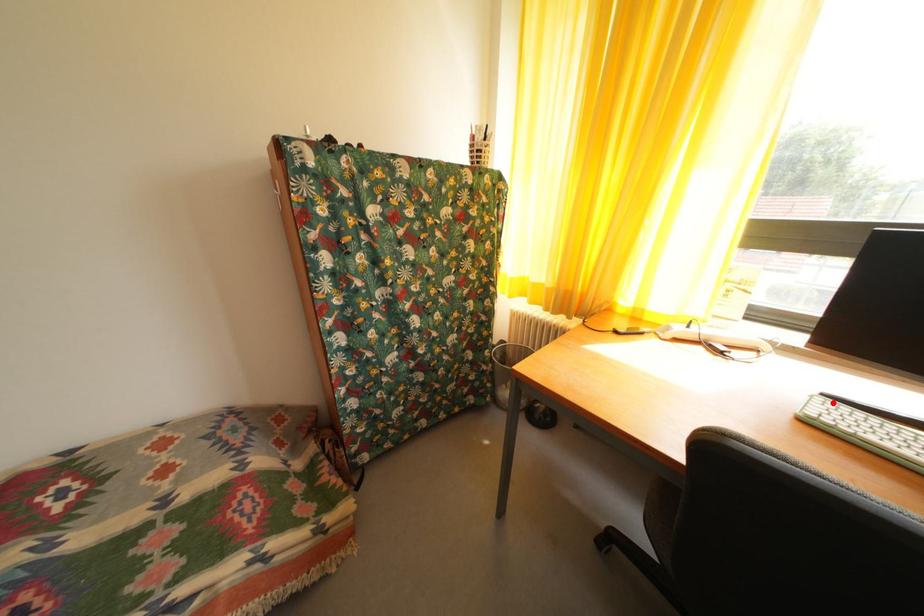
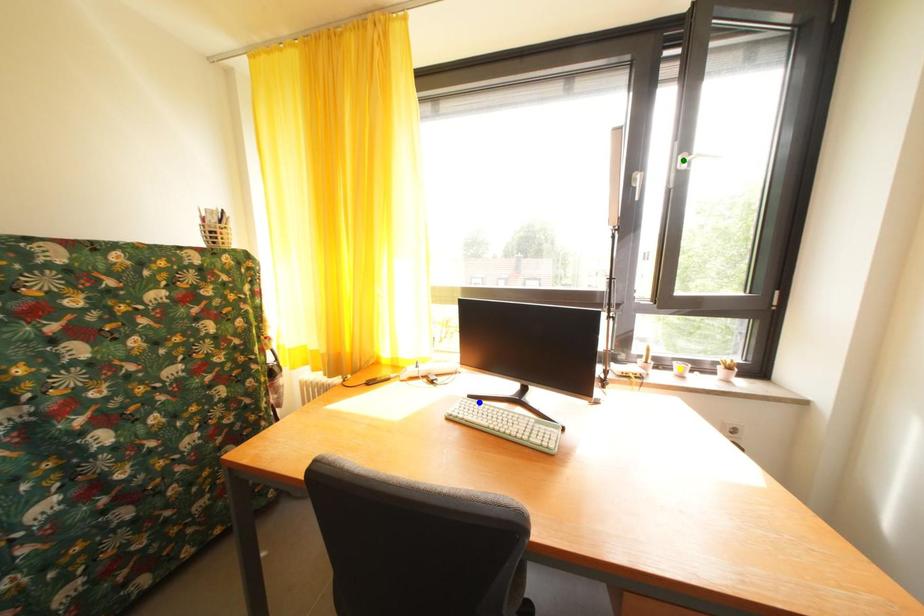
Question: I am providing you with two images of the same scene from different viewpoints. A red point is marked on the first image. You are given multiple points on the second image. In image 2, which mark is for the same physical point as the one in image 1?

Choices:
 (A) yellow point
 (B) blue point
 (C) green point

Answer: (B)